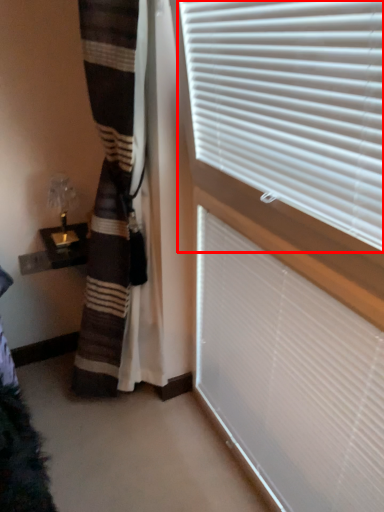
Question: Considering the relative positions of window blind (annotated by the red box) and window blind in the image provided, where is window blind (annotated by the red box) located with respect to the staircase?

Choices:
 (A) right
 (B) left

Answer: (B)